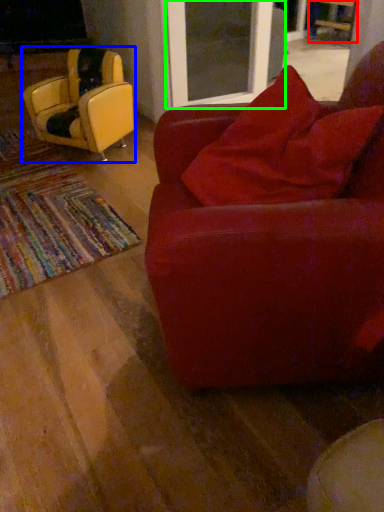
Question: Estimate the real-world distances between objects in this image. Which object is farther from chair (highlighted by a red box), chair (highlighted by a blue box) or screen door (highlighted by a green box)?

Choices:
 (A) chair
 (B) screen door

Answer: (A)